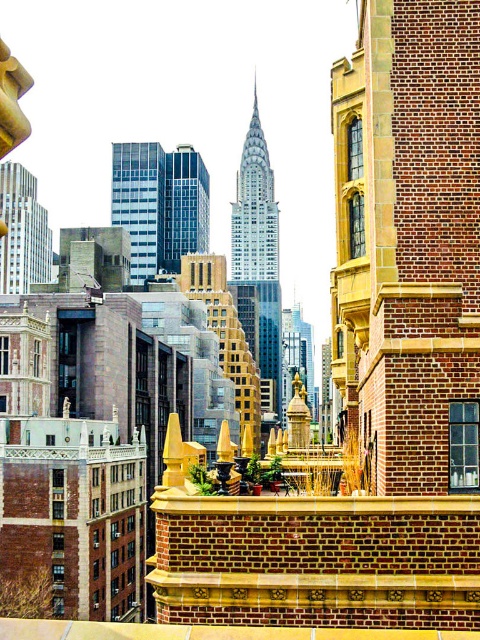
Question: Which point is closer to the camera?

Choices:
 (A) (195, 508)
 (B) (248, 266)

Answer: (A)

Question: Does brick ledge at center come in front of glassy blue skyscraper at center?

Choices:
 (A) yes
 (B) no

Answer: (A)

Question: Considering the real-world distances, which object is closest to the blue glass skyscraper at center?

Choices:
 (A) brick ledge at center
 (B) brick wall at center
 (C) matte glass skyscraper at upper left
 (D) shiny glass skyscraper at center

Answer: (D)

Question: Which of the following is the farthest from the observer?

Choices:
 (A) blue glass skyscraper at center
 (B) brick ledge at center
 (C) glassy blue skyscraper at center
 (D) shiny glass skyscraper at center

Answer: (A)

Question: Can you confirm if brick wall at center is thinner than blue glass skyscraper at center?

Choices:
 (A) yes
 (B) no

Answer: (A)

Question: Can you confirm if brick ledge at center is positioned to the right of matte glass skyscraper at upper left?

Choices:
 (A) no
 (B) yes

Answer: (B)